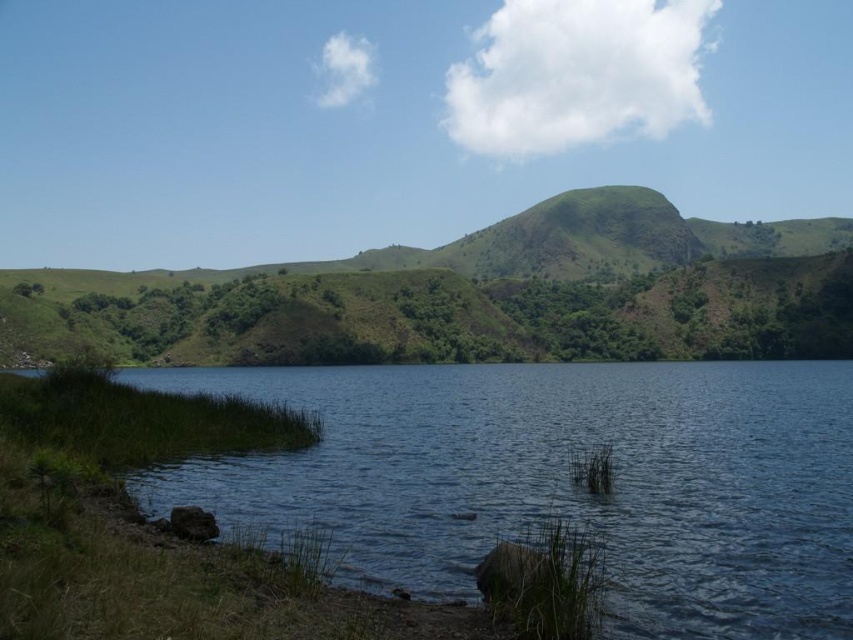
Question: Is clear water at lower left thinner than green grassy hill at center?

Choices:
 (A) no
 (B) yes

Answer: (B)

Question: Among these objects, which one is farthest from the camera?

Choices:
 (A) green grassy hill at center
 (B) clear water at lower left

Answer: (A)

Question: Can you confirm if clear water at lower left is bigger than green grassy hill at center?

Choices:
 (A) yes
 (B) no

Answer: (B)

Question: Does clear water at lower left appear on the right side of green grassy hill at center?

Choices:
 (A) yes
 (B) no

Answer: (B)